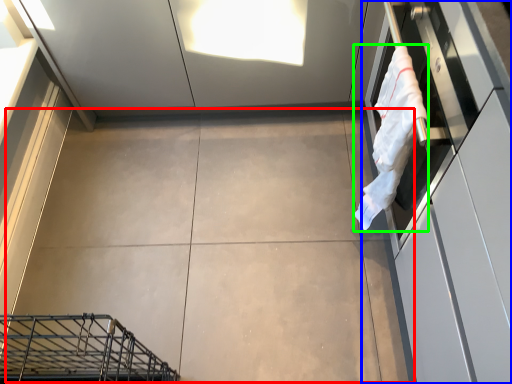
Question: Which object is positioned farthest from concrete (highlighted by a red box)? Select from cabinetry (highlighted by a blue box) and laundry (highlighted by a green box).

Choices:
 (A) cabinetry
 (B) laundry

Answer: (A)